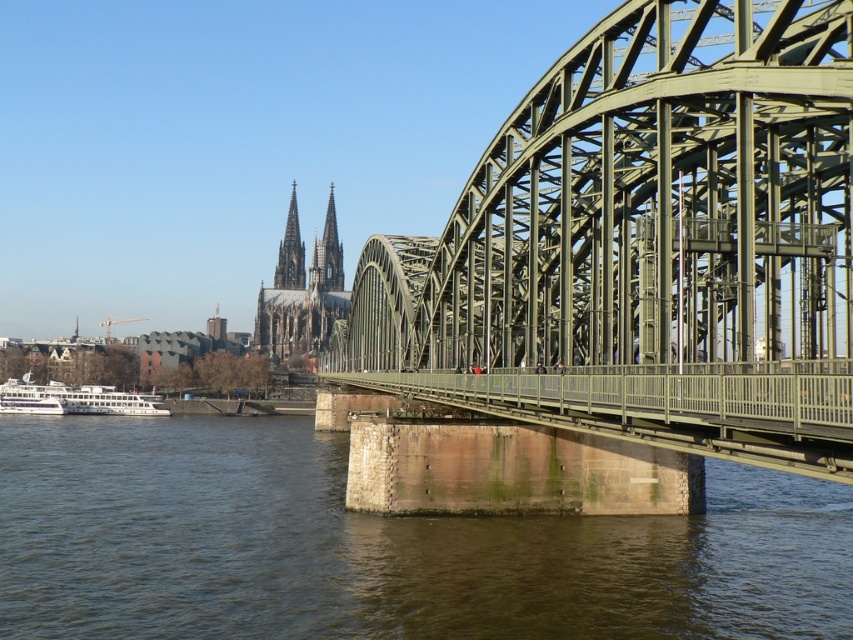
Between green stone cathedral at center and smooth gray stone spire at upper center, which one appears on the left side from the viewer's perspective?

smooth gray stone spire at upper center is more to the left.

What do you see at coordinates (300, 291) in the screenshot? The width and height of the screenshot is (853, 640). I see `green stone cathedral at center` at bounding box center [300, 291].

Where is `green stone cathedral at center`? This screenshot has width=853, height=640. green stone cathedral at center is located at coordinates (300, 291).

Between green stone cathedral at center and smooth stone spire at center, which one is positioned higher?

smooth stone spire at center is above.

Can you confirm if green stone cathedral at center is positioned above smooth stone spire at center?

Actually, green stone cathedral at center is below smooth stone spire at center.

Does point (309, 269) come in front of point (340, 269)?

Yes, point (309, 269) is in front of point (340, 269).

Where is `green stone cathedral at center`? The width and height of the screenshot is (853, 640). green stone cathedral at center is located at coordinates [x=300, y=291].

Can you confirm if white matte boat at lower left is bigger than smooth gray stone spire at upper center?

No, white matte boat at lower left is not bigger than smooth gray stone spire at upper center.

Can you confirm if white matte boat at lower left is taller than smooth gray stone spire at upper center?

No.

Find the location of a particular element. The height and width of the screenshot is (640, 853). white matte boat at lower left is located at coordinates (30, 396).